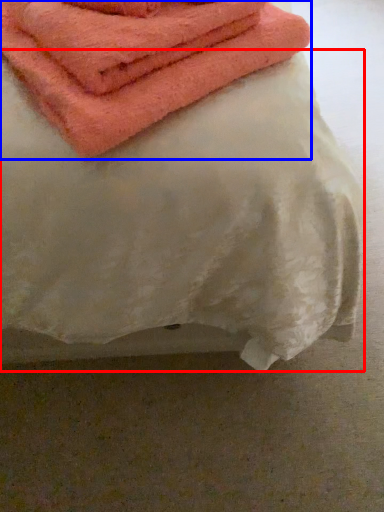
Question: Among these objects, which one is nearest to the camera, sheet (highlighted by a red box) or towel (highlighted by a blue box)?

Choices:
 (A) sheet
 (B) towel

Answer: (A)